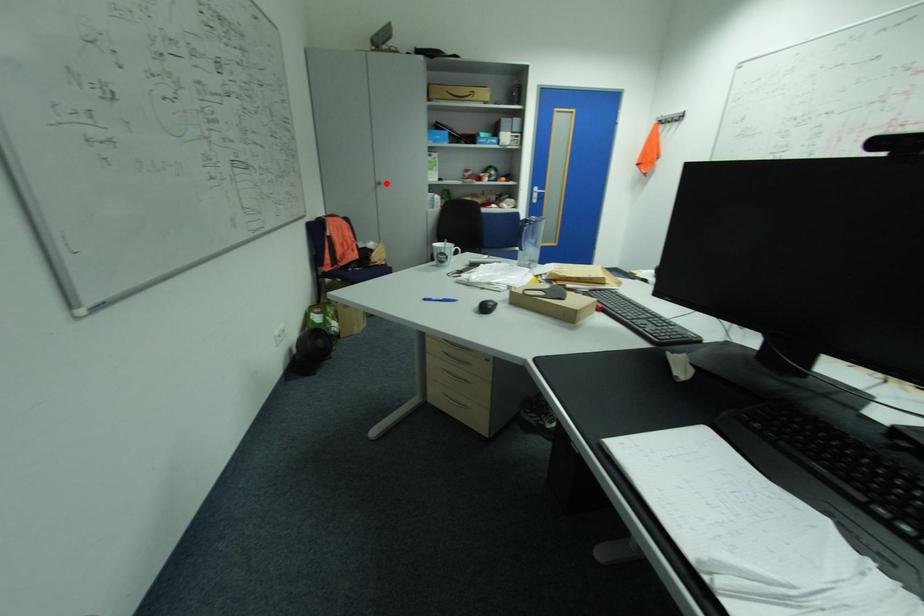
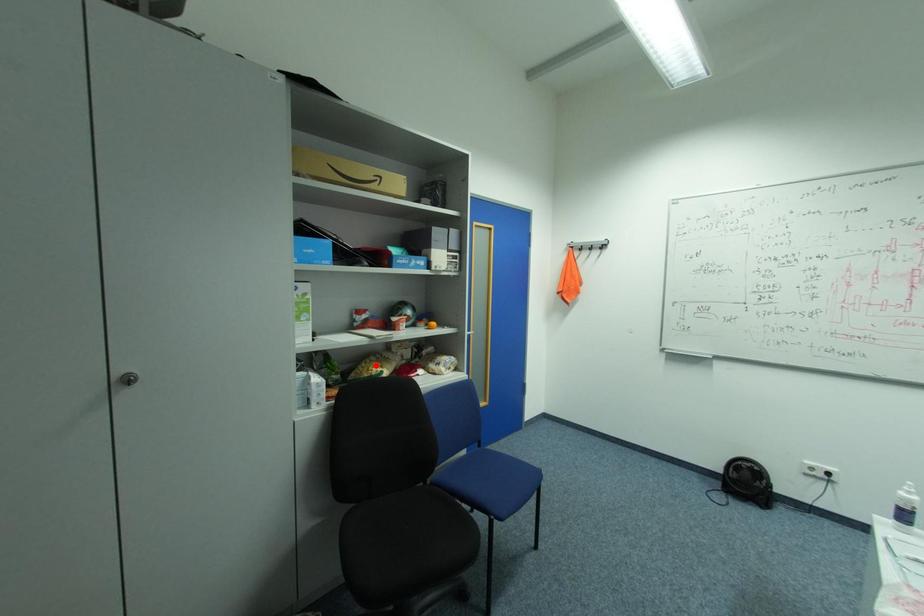
I am providing you with two images of the same scene from different viewpoints. A red point is marked on the first image and another point is marked on the second image. Is the marked point in image1 the same physical position as the marked point in image2?

No